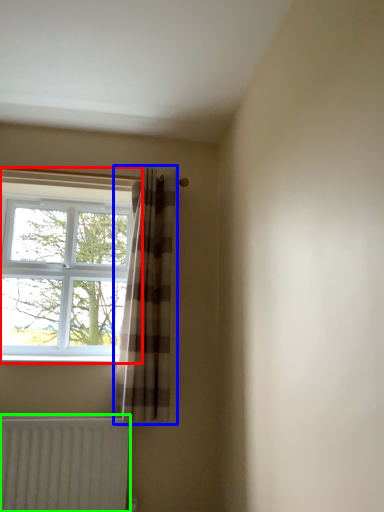
Question: Considering the real-world distances, which object is closest to window (highlighted by a red box)? curtain (highlighted by a blue box) or radiator (highlighted by a green box).

Choices:
 (A) curtain
 (B) radiator

Answer: (A)